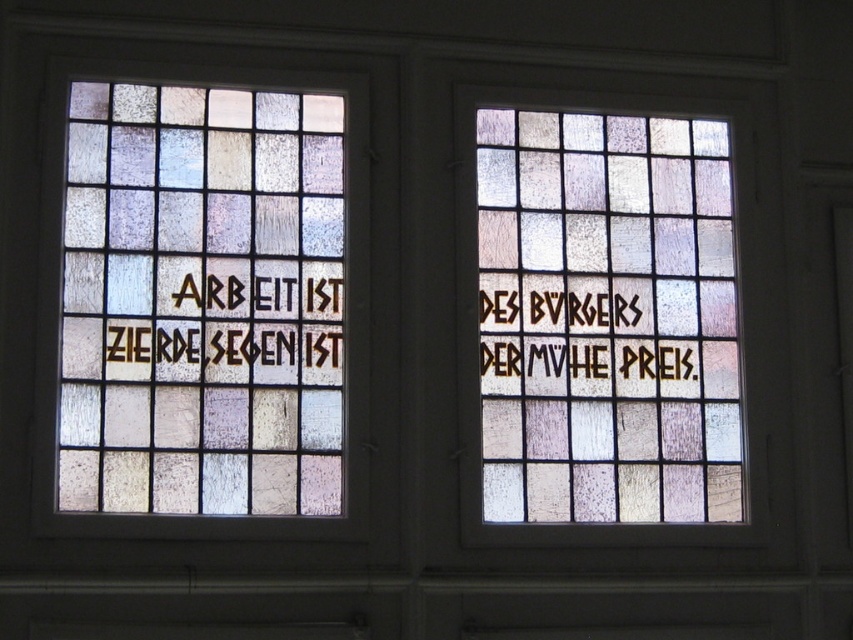
Question: Does translucent stained glass at right appear under brown textured glass at left?

Choices:
 (A) no
 (B) yes

Answer: (A)

Question: Does translucent stained glass at left have a lesser width compared to translucent stained glass at right?

Choices:
 (A) no
 (B) yes

Answer: (B)

Question: Which object is closer to the camera taking this photo?

Choices:
 (A) brown textured lettering at center right
 (B) translucent stained glass at left

Answer: (B)

Question: Which point appears closest to the camera in this image?

Choices:
 (A) (140, 353)
 (B) (256, 416)

Answer: (A)

Question: Which point is farther from the camera taking this photo?

Choices:
 (A) (595, 376)
 (B) (299, 376)
 (C) (646, 259)
 (D) (300, 291)

Answer: (C)

Question: In this image, where is translucent stained glass at right located relative to brown textured lettering at center right?

Choices:
 (A) above
 (B) below

Answer: (A)